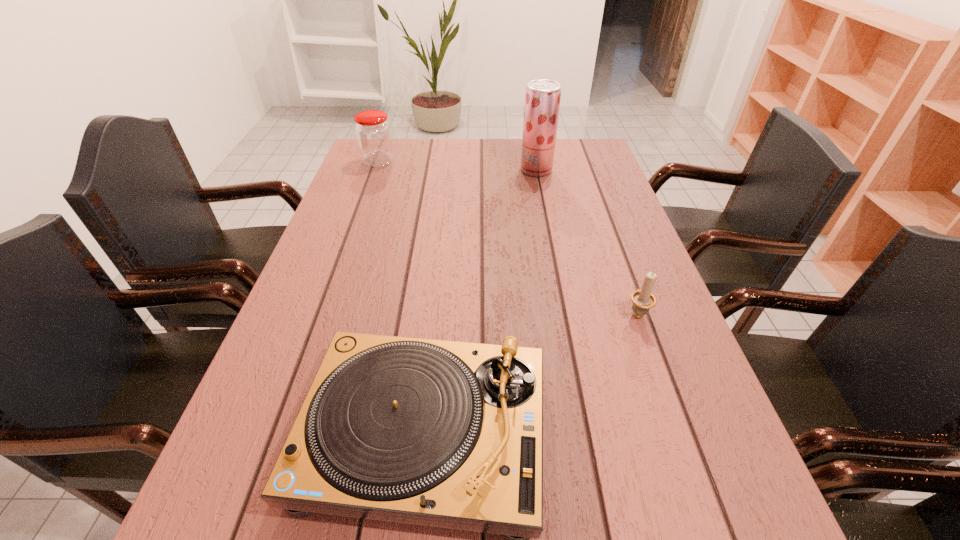
The image size is (960, 540). Identify the location of fruit juice that is at the far edge. pyautogui.click(x=542, y=100).

You are a GUI agent. You are given a task and a screenshot of the screen. Output one action in this format:
    pyautogui.click(x=<x>, y=<y>)
    Task: Click on the jar at the far edge
    
    Given the screenshot: What is the action you would take?
    pyautogui.click(x=373, y=133)

You are a GUI agent. You are given a task and a screenshot of the screen. Output one action in this format:
    pyautogui.click(x=<x>, y=<y>)
    Task: Click on the object located at the left edge
    This screenshot has width=960, height=540.
    Given the screenshot: What is the action you would take?
    pyautogui.click(x=373, y=133)

Identify the location of object positioned at the right edge. (643, 300).

Image resolution: width=960 pixels, height=540 pixels. What are the coordinates of `object present at the far left corner` in the screenshot? It's located at coord(373,133).

This screenshot has height=540, width=960. Find the location of `vacant space at the left edge of the desktop`. vacant space at the left edge of the desktop is located at coordinates (322, 261).

In the image, there is a desktop. At what (x,y) coordinates should I click in order to perform the action: click on free space at the right edge. Please return your answer as a coordinate pair (x, y). Looking at the image, I should click on (640, 266).

The width and height of the screenshot is (960, 540). In the image, there is a desktop. In order to click on free space at the far left corner in this screenshot , I will do `click(395, 171)`.

Find the location of a particular element. The image size is (960, 540). free space at the far right corner of the desktop is located at coordinates (569, 148).

This screenshot has width=960, height=540. In order to click on vacant space that is in between the rightmost object and the second tallest object in this screenshot , I will do `click(508, 237)`.